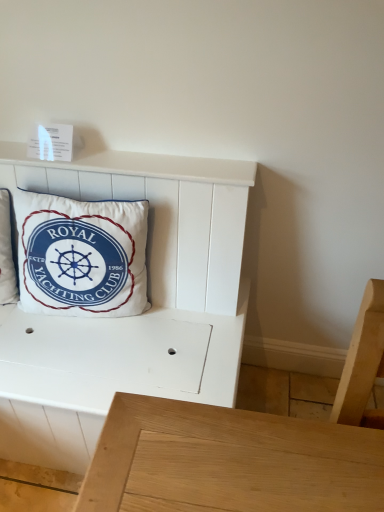
The width and height of the screenshot is (384, 512). Identify the location of white cotton cushion at upper left. (81, 255).

This screenshot has height=512, width=384. Describe the element at coordinates (81, 255) in the screenshot. I see `white cotton cushion at upper left` at that location.

Where is `white cotton cushion at upper left`? white cotton cushion at upper left is located at coordinates (81, 255).